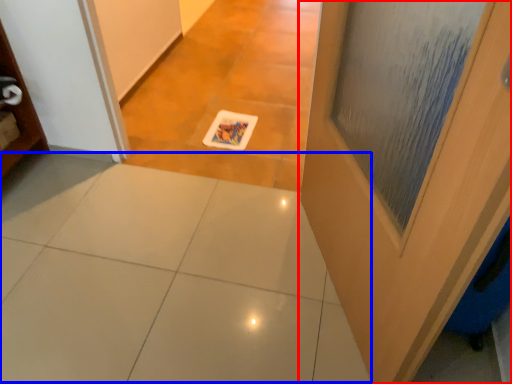
Question: Which point is closer to the camera, door (highlighted by a red box) or ceramic tile (highlighted by a blue box)?

Choices:
 (A) door
 (B) ceramic tile

Answer: (A)